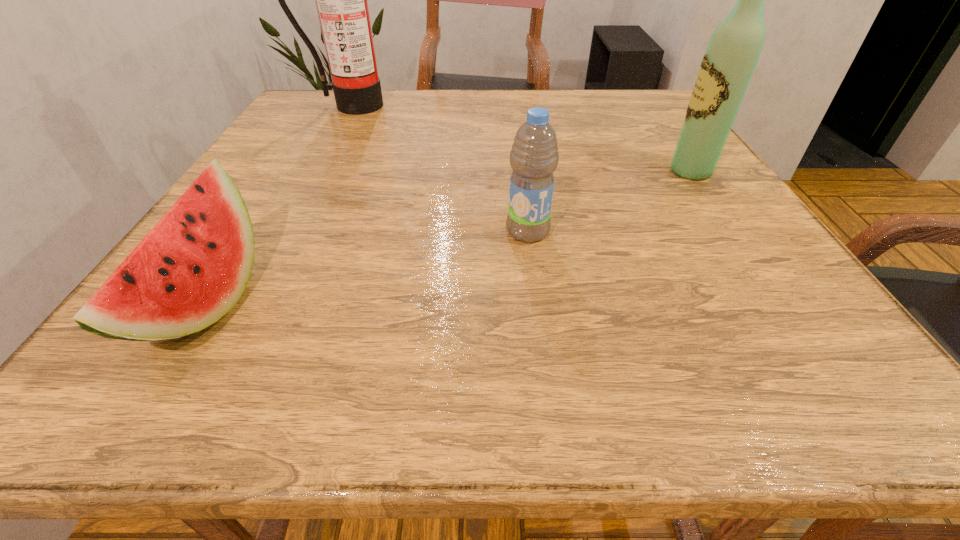
I want to click on vacant area situated 0.200m on the right of the third object from left to right, so click(x=664, y=232).

This screenshot has width=960, height=540. I want to click on vacant space located on the outer rind of the shortest object, so click(505, 304).

At what (x,y) coordinates should I click in order to perform the action: click on object present at the far edge. Please return your answer as a coordinate pair (x, y). Looking at the image, I should click on point(341,0).

In order to click on object that is at the near edge in this screenshot , I will do `click(193, 266)`.

Locate an element on the screen. This screenshot has height=540, width=960. fire extinguisher located in the left edge section of the desktop is located at coordinates (341, 0).

Locate an element on the screen. This screenshot has width=960, height=540. watermelon located in the left edge section of the desktop is located at coordinates (193, 266).

Where is `object located in the right edge section of the desktop`? object located in the right edge section of the desktop is located at coordinates click(x=729, y=61).

The width and height of the screenshot is (960, 540). Identify the location of object at the far left corner. (341, 0).

Where is `object present at the near left corner`? object present at the near left corner is located at coordinates (193, 266).

Image resolution: width=960 pixels, height=540 pixels. In order to click on vacant space at the far edge of the desktop in this screenshot , I will do `click(511, 93)`.